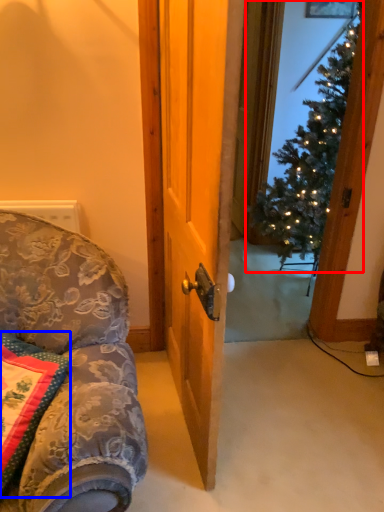
Question: Which object appears farthest to the camera in this image, christmas tree (highlighted by a red box) or pillow (highlighted by a blue box)?

Choices:
 (A) christmas tree
 (B) pillow

Answer: (A)